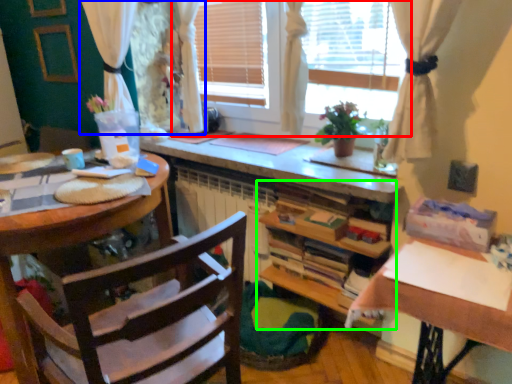
Question: Estimate the real-world distances between objects in this image. Which object is farther from window (highlighted by a red box), curtain (highlighted by a blue box) or cabinetry (highlighted by a green box)?

Choices:
 (A) curtain
 (B) cabinetry

Answer: (A)